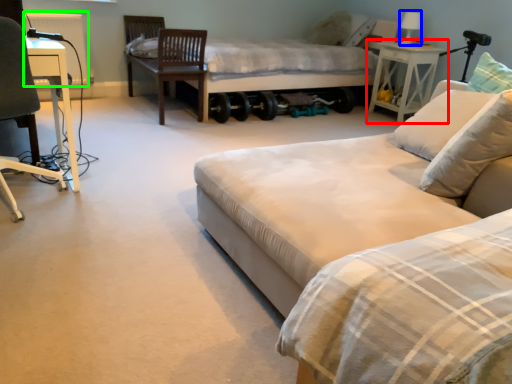
Question: Estimate the real-world distances between objects in this image. Which object is farther from nightstand (highlighted by a red box), table lamp (highlighted by a blue box) or radiator (highlighted by a green box)?

Choices:
 (A) table lamp
 (B) radiator

Answer: (B)